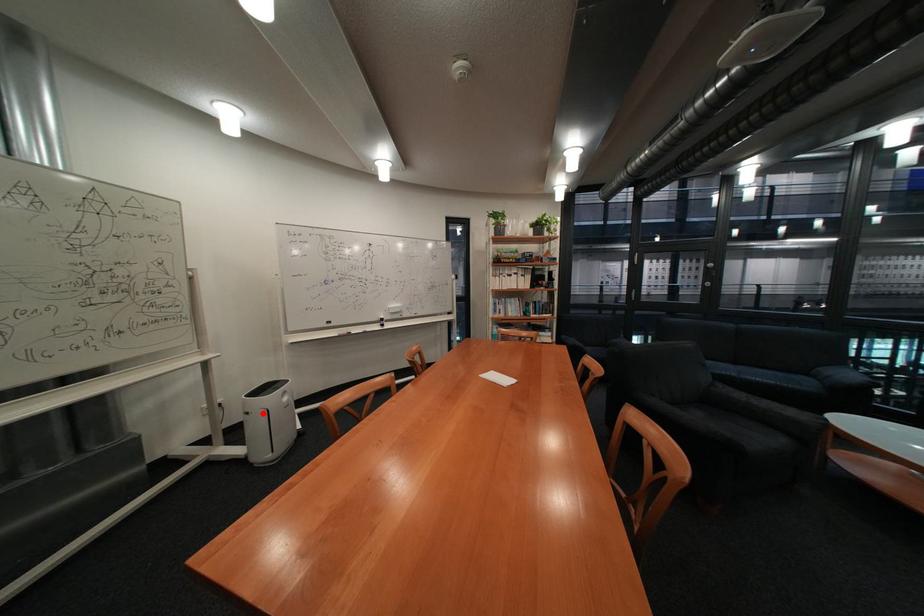
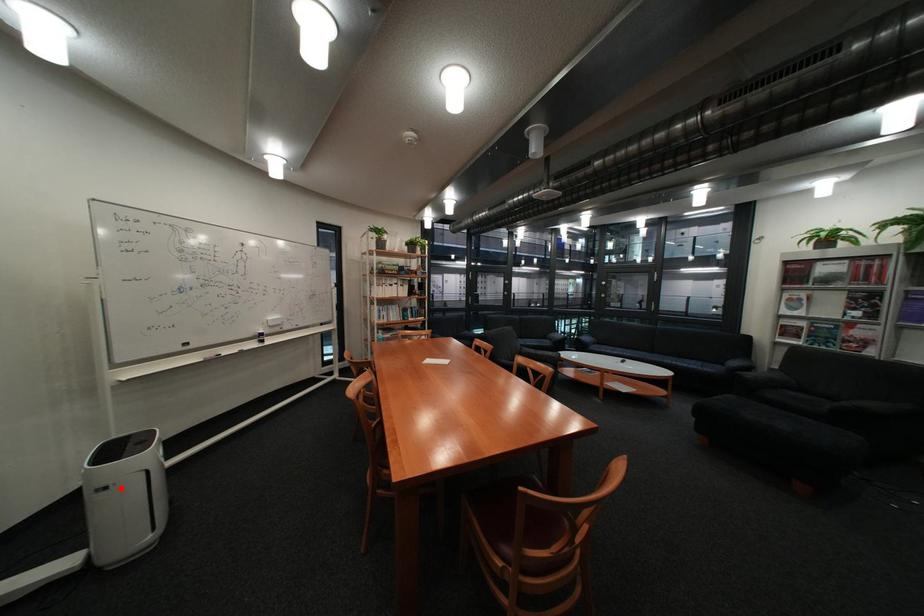
I am providing you with two images of the same scene from different viewpoints. A red point is marked on the first image and another point is marked on the second image. Do the highlighted points in image1 and image2 indicate the same real-world spot?

Yes